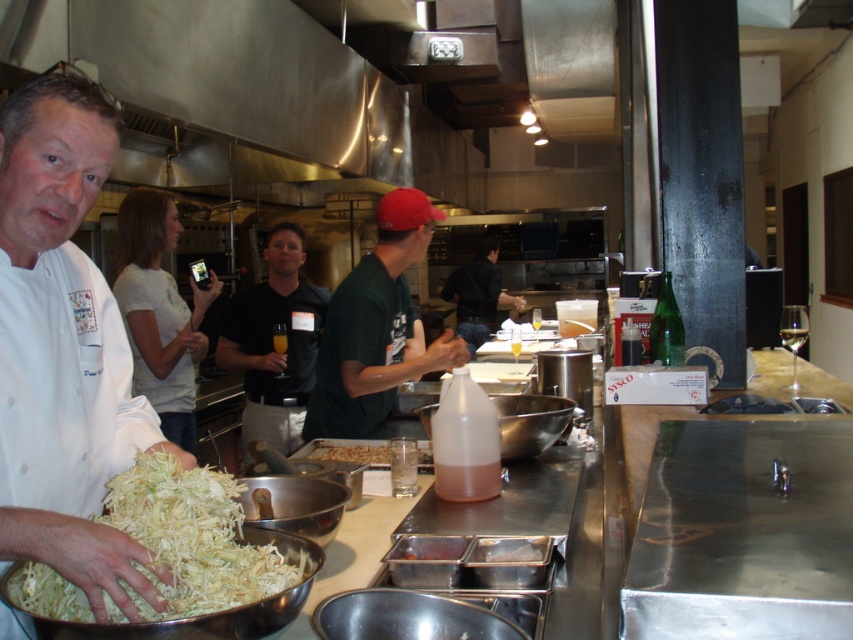
From the picture: You are a kitchen assistant who needs to place a 12 inch long spatula between the white shredded food at left and the translucent plastic nuts at center. Is there enough space?

The distance between the white shredded food at left and the translucent plastic nuts at center is 36.61 inches, so yes, there is enough space to place a 12 inch long spatula between them.

You are a new employee in the kitchen and need to identify the staff members based on their clothing. Which staff member has a wider torso? The options are the green matte shirt at center and the black matte shirt at center.

The green matte shirt at center has a greater width than the black matte shirt at center, so the staff member wearing the green matte shirt at center has a wider torso.

Looking at this image, you are a customer in this kitchen and need to choose between the white chef coat at center and the translucent plastic nuts at center to hide a small object. Which one would be a better option?

The translucent plastic nuts at center are thicker than the white chef coat at center, so they would be a better option to hide a small object.